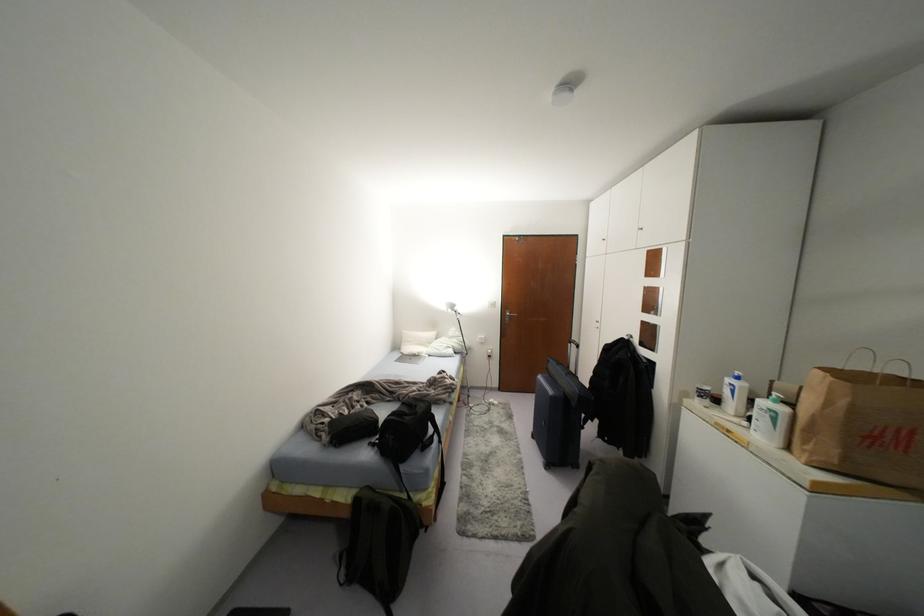
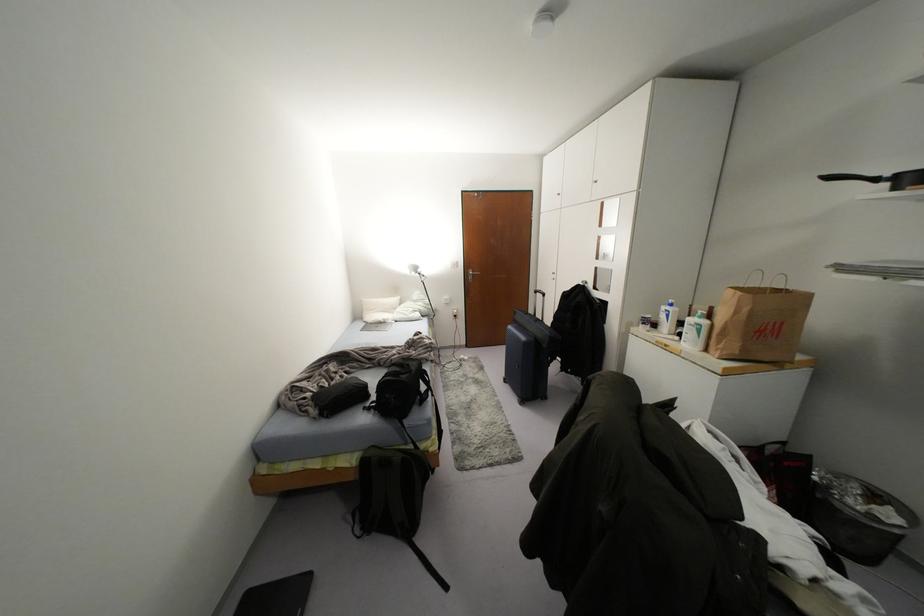
The point at (733,391) is marked in the first image. Where is the corresponding point in the second image?

(666, 315)